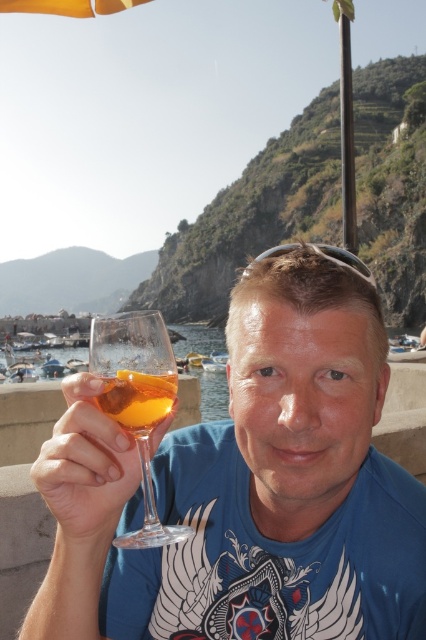
Who is taller, clear glass wine glass at center or transparent glass at center?

clear glass wine glass at center

Between point (138, 476) and point (120, 339), which one is positioned behind?

Point (138, 476)

Identify the location of clear glass wine glass at center. This screenshot has width=426, height=640. (247, 486).

What are the coordinates of `clear glass wine glass at center` in the screenshot? It's located at (247, 486).

Is transparent glass at center thinner than translucent amber liquid at center?

No, transparent glass at center is not thinner than translucent amber liquid at center.

Which is more to the right, transparent glass at center or translucent amber liquid at center?

translucent amber liquid at center is more to the right.

Which is in front, point (129, 381) or point (166, 406)?

Point (129, 381)

You are a GUI agent. You are given a task and a screenshot of the screen. Output one action in this format:
    pyautogui.click(x=<x>, y=<y>)
    Task: Click on the transparent glass at center
    
    Given the screenshot: What is the action you would take?
    pyautogui.click(x=137, y=401)

How much distance is there between clear glass wine glass at center and translucent amber liquid at center?

clear glass wine glass at center and translucent amber liquid at center are 12.86 feet apart from each other.

Measure the distance between clear glass wine glass at center and camera.

They are 20.71 meters apart.

Who is more distant from viewer, (319,348) or (135,396)?

The point (319,348) is more distant.

I want to click on clear glass wine glass at center, so click(247, 486).